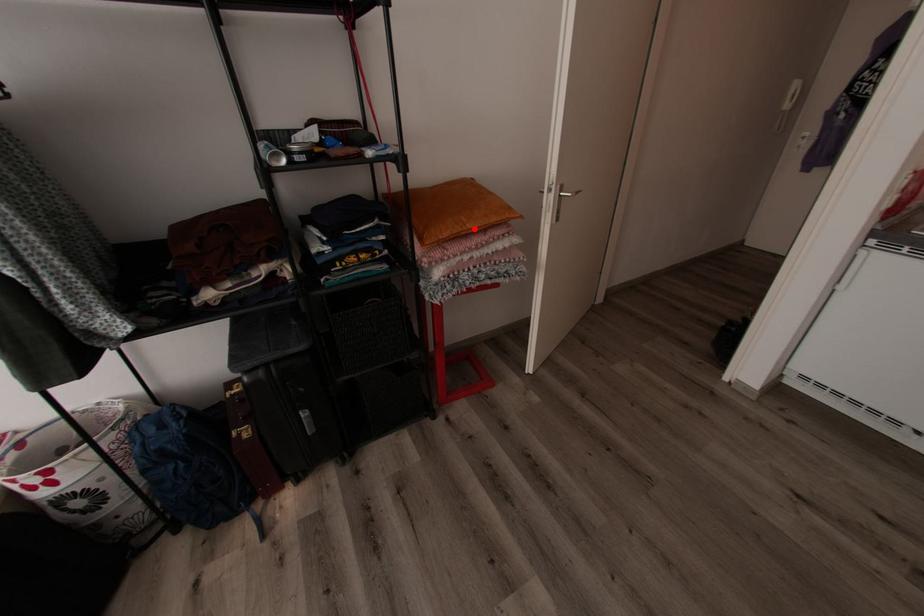
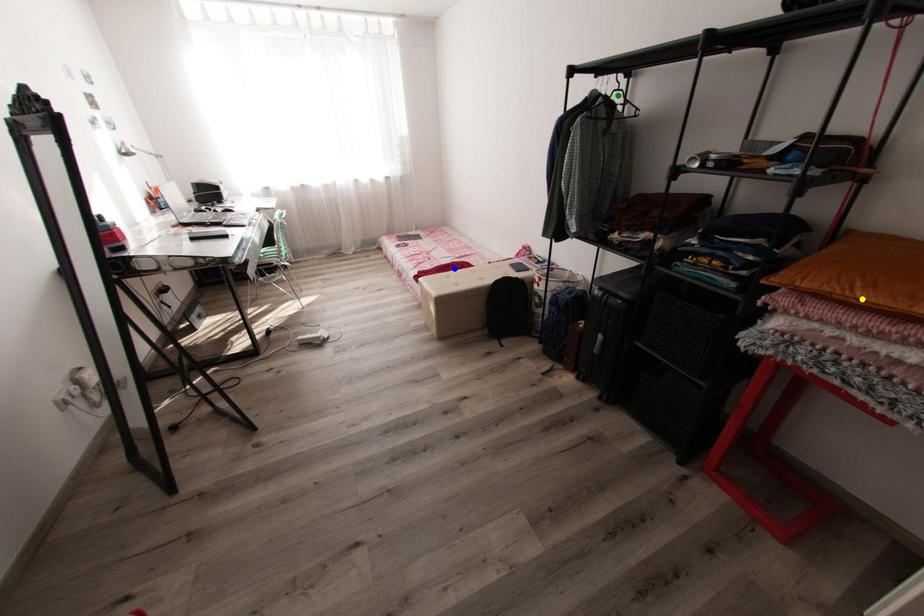
Question: I am providing you with two images of the same scene from different viewpoints. A red point is marked on the first image. You are given multiple points on the second image. Which point in image 2 is actually the same real-world point as the red point in image 1?

Choices:
 (A) green point
 (B) yellow point
 (C) blue point

Answer: (B)